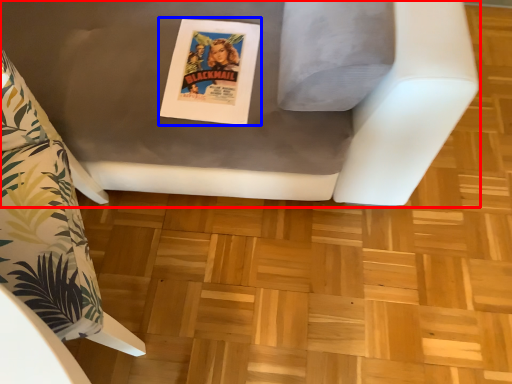
Question: Which object is further to the camera taking this photo, furniture (highlighted by a red box) or comic book (highlighted by a blue box)?

Choices:
 (A) furniture
 (B) comic book

Answer: (B)